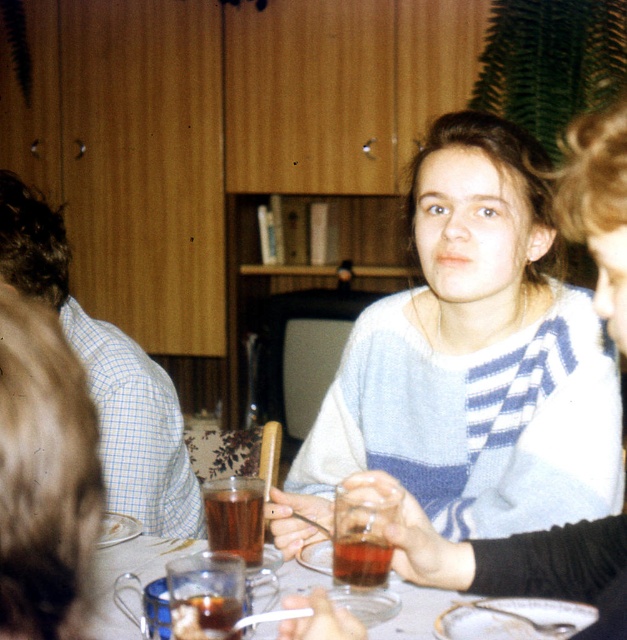
Question: Can you confirm if white knit sweater at center is wider than translucent glass tea cup at center?

Choices:
 (A) no
 (B) yes

Answer: (A)

Question: Can you confirm if brown liquid at center is thinner than translucent glass at center?

Choices:
 (A) yes
 (B) no

Answer: (B)

Question: Is the position of translucent glass tea cup at center more distant than that of translucent glass at center?

Choices:
 (A) yes
 (B) no

Answer: (B)

Question: Which of the following is the farthest from the observer?

Choices:
 (A) (238, 490)
 (B) (300, 484)
 (C) (3, 259)

Answer: (B)

Question: Which object appears farthest from the camera in this image?

Choices:
 (A) brown liquid at center
 (B) white knit sweater at center
 (C) translucent glass tea cup at center

Answer: (B)

Question: Which point is farther from the camera taking this photo?

Choices:
 (A) (145, 568)
 (B) (142, 413)
 (C) (240, 481)

Answer: (B)